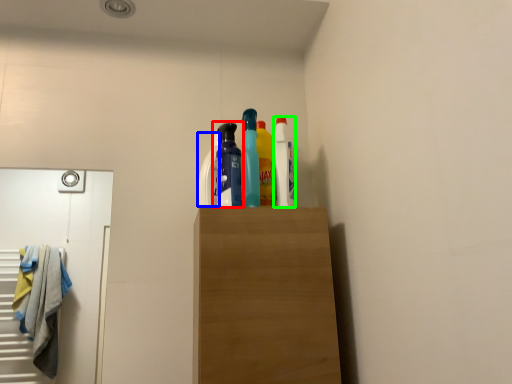
Question: Based on their relative distances, which object is nearer to bottle (highlighted by a red box)? Choose from cleaning product (highlighted by a blue box) and cleaning product (highlighted by a green box).

Choices:
 (A) cleaning product
 (B) cleaning product

Answer: (A)